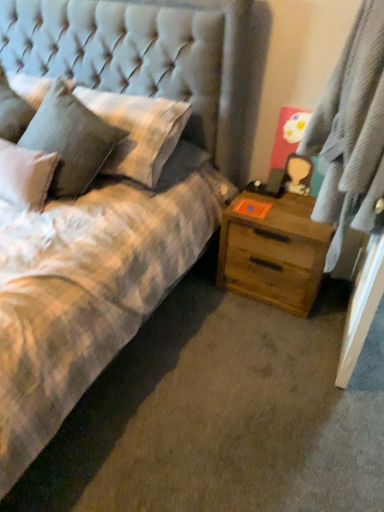
What do you see at coordinates (155, 59) in the screenshot?
I see `tufted fabric headboard at upper left` at bounding box center [155, 59].

In order to face textured gray pillow at upper left, the 1th pillow viewed from the right, should I rotate leftwards or rightwards?

You should rotate left by 6.899 degrees.

At what (x,y) coordinates should I click in order to perform the action: click on textured gray pillow at upper left, the 1th pillow viewed from the right. Please return your answer as a coordinate pair (x, y). Looking at the image, I should click on (138, 131).

I want to click on wooden nightstand at right, so click(x=274, y=253).

At what (x,y) coordinates should I click in order to perform the action: click on tufted fabric headboard at upper left. Please return your answer as a coordinate pair (x, y). Looking at the image, I should click on (155, 59).

Can you confirm if wooden nightstand at right is positioned to the right of textured gray pillow at upper left, the 1th pillow viewed from the right?

Indeed, wooden nightstand at right is positioned on the right side of textured gray pillow at upper left, the 1th pillow viewed from the right.

Is wooden nightstand at right situated inside textured gray pillow at upper left, placed as the 2th pillow when sorted from left to right, or outside?

wooden nightstand at right exists outside the volume of textured gray pillow at upper left, placed as the 2th pillow when sorted from left to right.

Who is taller, wooden nightstand at right or textured gray pillow at upper left, the 1th pillow viewed from the right?

wooden nightstand at right.

Could you tell me if gray textured curtain at right is turned towards tufted fabric headboard at upper left?

Yes, gray textured curtain at right faces towards tufted fabric headboard at upper left.

Where is `curtain in front of the tufted fabric headboard at upper left`? curtain in front of the tufted fabric headboard at upper left is located at coordinates (351, 132).

Does gray textured curtain at right have a larger size compared to tufted fabric headboard at upper left?

Indeed, gray textured curtain at right has a larger size compared to tufted fabric headboard at upper left.

Is gray textured curtain at right positioned far away from tufted fabric headboard at upper left?

Actually, gray textured curtain at right and tufted fabric headboard at upper left are a little close together.

Does point (356, 95) lie in front of point (120, 125)?

Yes, it is in front of point (120, 125).

How different are the orientations of gray textured curtain at right and textured gray pillow at upper left, the 1th pillow viewed from the right, in degrees?

The angular difference between gray textured curtain at right and textured gray pillow at upper left, the 1th pillow viewed from the right, is 74.1 degrees.

Is gray textured curtain at right touching textured gray pillow at upper left, the 1th pillow viewed from the right?

No, gray textured curtain at right is not in contact with textured gray pillow at upper left, the 1th pillow viewed from the right.

Could you tell me if gray textured curtain at right is facing textured gray pillow at upper left, placed as the 2th pillow when sorted from left to right?

Yes, gray textured curtain at right is oriented towards textured gray pillow at upper left, placed as the 2th pillow when sorted from left to right.

Could you tell me if fluffy white pillow at upper left, which appears as the first pillow when viewed from the left, is turned towards gray textured curtain at right?

No, fluffy white pillow at upper left, which appears as the first pillow when viewed from the left, is not facing towards gray textured curtain at right.

From the image's perspective, which object appears higher, fluffy white pillow at upper left, which appears as the first pillow when viewed from the left, or gray textured curtain at right?

fluffy white pillow at upper left, which appears as the first pillow when viewed from the left, from the image's perspective.

From a real-world perspective, which object rests below the other?

From a 3D spatial view, fluffy white pillow at upper left, acting as the second pillow starting from the right, is below.

Is tufted fabric headboard at upper left turned away from wooden nightstand at right?

No.

Is tufted fabric headboard at upper left not close to wooden nightstand at right?

No, tufted fabric headboard at upper left is not far from wooden nightstand at right.

Does point (249, 156) appear closer or farther from the camera than point (226, 285)?

Point (249, 156) is farther from the camera than point (226, 285).

Can you tell me how much tufted fabric headboard at upper left and wooden nightstand at right differ in facing direction?

tufted fabric headboard at upper left and wooden nightstand at right are facing 4.3 degrees away from each other.

In terms of width, does textured gray pillow at upper left, placed as the 2th pillow when sorted from left to right, look wider or thinner when compared to wooden nightstand at right?

textured gray pillow at upper left, placed as the 2th pillow when sorted from left to right, is wider than wooden nightstand at right.

Is wooden nightstand at right at the back of textured gray pillow at upper left, the 1th pillow viewed from the right?

No, textured gray pillow at upper left, the 1th pillow viewed from the right,'s orientation is not away from wooden nightstand at right.

Does textured gray pillow at upper left, placed as the 2th pillow when sorted from left to right, have a lesser height compared to wooden nightstand at right?

Yes.

Is textured gray pillow at upper left, the 1th pillow viewed from the right, looking in the opposite direction of tufted fabric headboard at upper left?

Yes, tufted fabric headboard at upper left is at the back of textured gray pillow at upper left, the 1th pillow viewed from the right.

Which object is wider, textured gray pillow at upper left, placed as the 2th pillow when sorted from left to right, or tufted fabric headboard at upper left?

tufted fabric headboard at upper left is wider.

From a real-world perspective, relative to tufted fabric headboard at upper left, is textured gray pillow at upper left, placed as the 2th pillow when sorted from left to right, vertically above or below?

textured gray pillow at upper left, placed as the 2th pillow when sorted from left to right, is situated lower than tufted fabric headboard at upper left in the real world.

Find the location of a particular element. The height and width of the screenshot is (512, 384). pillow beneath the tufted fabric headboard at upper left (from a real-world perspective) is located at coordinates (138, 131).

From a real-world perspective, which pillow is the 1st one above the wooden nightstand at right? Please provide its 2D coordinates.

[(138, 131)]

Where is `curtain lying in front of the tufted fabric headboard at upper left`? curtain lying in front of the tufted fabric headboard at upper left is located at coordinates (351, 132).

Based on their spatial positions, is tufted fabric headboard at upper left or textured gray pillow at upper left, placed as the 2th pillow when sorted from left to right, closer to fluffy white pillow at upper left, acting as the second pillow starting from the right?

textured gray pillow at upper left, placed as the 2th pillow when sorted from left to right, is positioned closer to the anchor fluffy white pillow at upper left, acting as the second pillow starting from the right.

Considering their positions, is fluffy white pillow at upper left, acting as the second pillow starting from the right, positioned closer to wooden nightstand at right than gray textured curtain at right?

The object closer to wooden nightstand at right is gray textured curtain at right.

Considering their positions, is tufted fabric headboard at upper left positioned further to textured gray pillow at upper left, the 1th pillow viewed from the right, than wooden nightstand at right?

wooden nightstand at right lies further to textured gray pillow at upper left, the 1th pillow viewed from the right, than the other object.

Estimate the real-world distances between objects in this image. Which object is further from textured gray pillow at upper left, placed as the 2th pillow when sorted from left to right, wooden nightstand at right or tufted fabric headboard at upper left?

wooden nightstand at right is positioned further to the anchor textured gray pillow at upper left, placed as the 2th pillow when sorted from left to right.

Estimate the real-world distances between objects in this image. Which object is closer to wooden nightstand at right, textured gray pillow at upper left, the 1th pillow viewed from the right, or gray textured curtain at right?

Among the two, gray textured curtain at right is located nearer to wooden nightstand at right.

Considering their positions, is fluffy white pillow at upper left, acting as the second pillow starting from the right, positioned further to tufted fabric headboard at upper left than wooden nightstand at right?

wooden nightstand at right.

From the image, which object appears to be farther from wooden nightstand at right, gray textured curtain at right or tufted fabric headboard at upper left?

The object further to wooden nightstand at right is tufted fabric headboard at upper left.

Which object lies further to the anchor point textured gray pillow at upper left, placed as the 2th pillow when sorted from left to right, fluffy white pillow at upper left, acting as the second pillow starting from the right, or wooden nightstand at right?

wooden nightstand at right is positioned further to the anchor textured gray pillow at upper left, placed as the 2th pillow when sorted from left to right.

Where is `headboard between fluffy white pillow at upper left, which appears as the first pillow when viewed from the left, and wooden nightstand at right from left to right`? Image resolution: width=384 pixels, height=512 pixels. headboard between fluffy white pillow at upper left, which appears as the first pillow when viewed from the left, and wooden nightstand at right from left to right is located at coordinates (155, 59).

Find the location of `headboard located between fluffy white pillow at upper left, acting as the second pillow starting from the right, and gray textured curtain at right in the left-right direction`. headboard located between fluffy white pillow at upper left, acting as the second pillow starting from the right, and gray textured curtain at right in the left-right direction is located at coordinates (155, 59).

I want to click on nightstand situated between textured gray pillow at upper left, placed as the 2th pillow when sorted from left to right, and gray textured curtain at right from left to right, so [x=274, y=253].

This screenshot has height=512, width=384. In order to click on nightstand between tufted fabric headboard at upper left and gray textured curtain at right in this screenshot , I will do `click(274, 253)`.